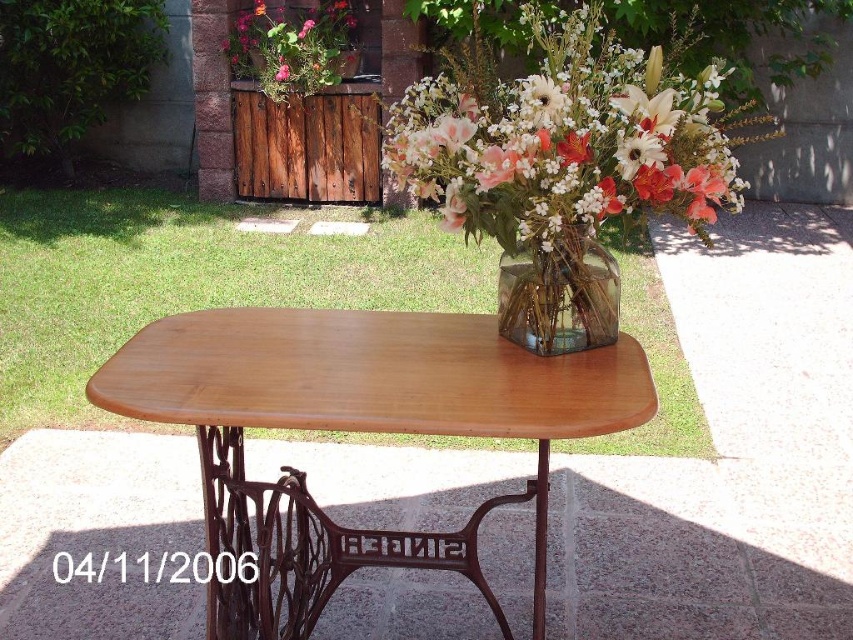
You are standing at the edge of the grassy lawn looking at the wooden table with the glass vase. There are two points marked on the table surface. Which point, point (466, 333) or point (412, 90), is closer to you?

Point (466, 333) is closer to you than point (412, 90).

You are a guest at a garden party and want to place a small plate on the light brown wood table at center without blocking the translucent glass vase at center. Is this possible?

The light brown wood table at center is below the translucent glass vase at center, so placing a small plate on the table would not block the vase since it is positioned underneath.

You are standing at the edge of the grassy lawn looking towards the wooden table. Where is the translucent glass vase at center located relative to your position?

The translucent glass vase at center is located at the coordinates point (564,138) relative to your position.